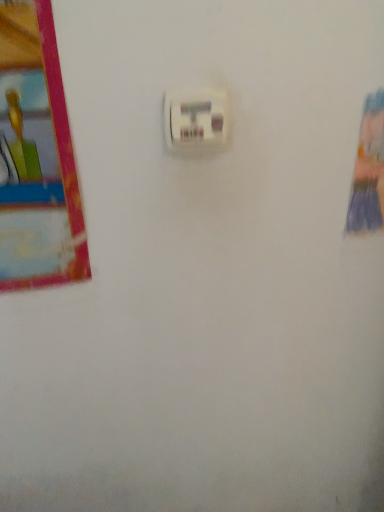
You are a GUI agent. You are given a task and a screenshot of the screen. Output one action in this format:
    pyautogui.click(x=<x>, y=<y>)
    Task: Click on the white plastic light switch at center
    
    Given the screenshot: What is the action you would take?
    pyautogui.click(x=196, y=119)

What do you see at coordinates (196, 119) in the screenshot? I see `white plastic light switch at center` at bounding box center [196, 119].

You are a GUI agent. You are given a task and a screenshot of the screen. Output one action in this format:
    pyautogui.click(x=<x>, y=<y>)
    Task: Click on the white plastic light switch at center
    This screenshot has height=512, width=384.
    Given the screenshot: What is the action you would take?
    pyautogui.click(x=196, y=119)